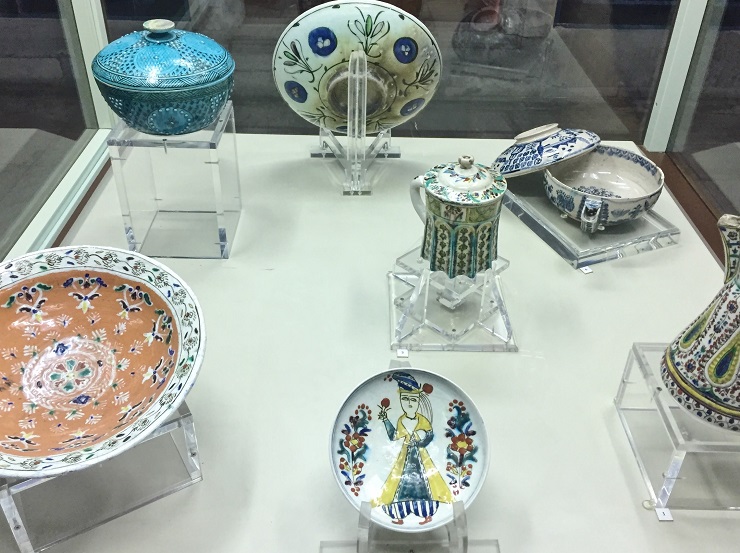
This screenshot has height=553, width=740. Identify the location of plate. (413, 441).